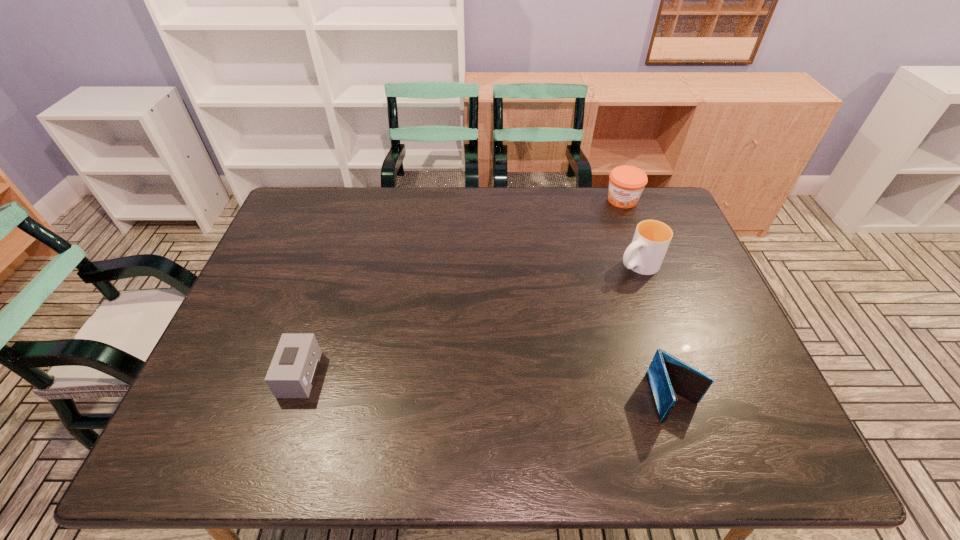
Locate an element on the screen. This screenshot has width=960, height=540. free space on the desktop that is between the shortest object and the wallet and is positioned with the handle on the side of the third nearest object is located at coordinates (431, 383).

You are a GUI agent. You are given a task and a screenshot of the screen. Output one action in this format:
    pyautogui.click(x=<x>, y=<y>)
    Task: Click on the free spot on the desktop that is between the alarm clock and the wallet and is positioned on the front label of the farthest object
    The image size is (960, 540).
    Given the screenshot: What is the action you would take?
    [529, 389]